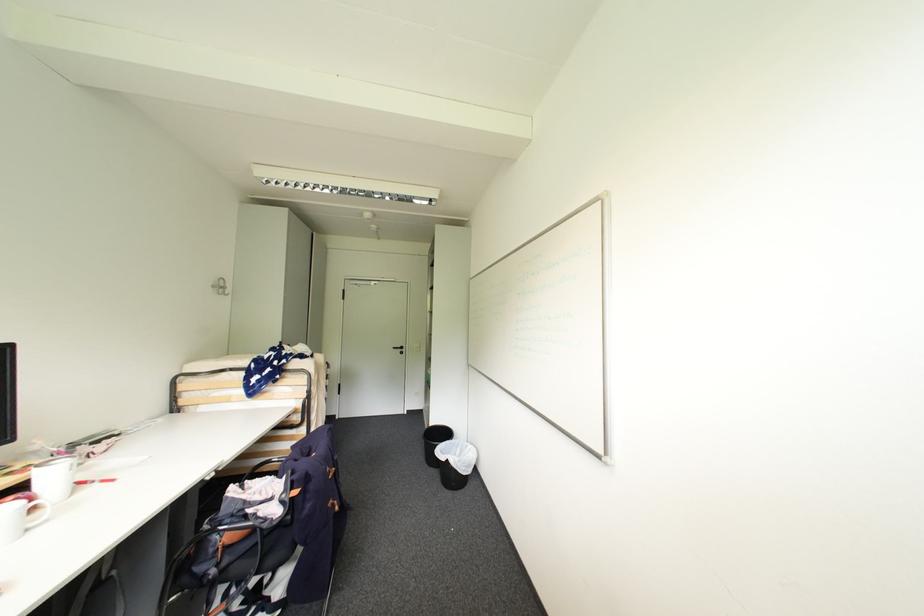
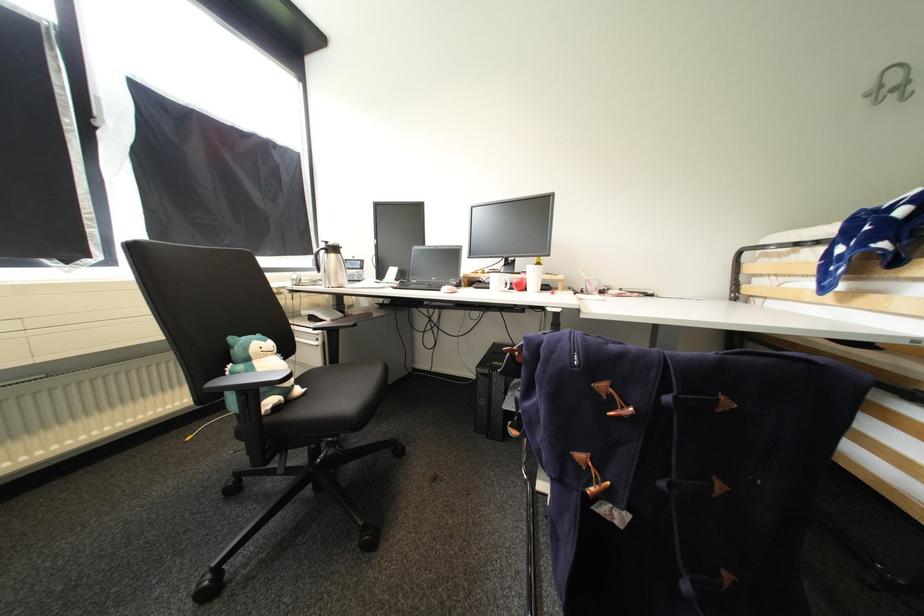
Locate, in the second image, the point that corresponds to [229,288] in the first image.

(912, 84)